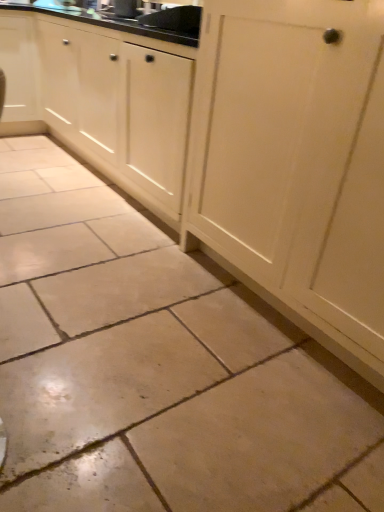
Question: Is matte white cabinet at upper left, arranged as the first cabinetry when viewed from the left, inside the boundaries of matte black sink at upper center, or outside?

Choices:
 (A) outside
 (B) inside

Answer: (A)

Question: Considering the positions of matte white cabinet at upper left, arranged as the first cabinetry when viewed from the left, and matte black sink at upper center in the image, is matte white cabinet at upper left, arranged as the first cabinetry when viewed from the left, bigger or smaller than matte black sink at upper center?

Choices:
 (A) small
 (B) big

Answer: (B)

Question: Which object is positioned closest to the matte white cabinet at upper left, arranged as the 2th cabinetry when viewed from the right?

Choices:
 (A) white wood cabinet at center, which is the first cabinetry in right-to-left order
 (B) matte black sink at upper center

Answer: (A)

Question: Which object is the closest to the white wood cabinet at center, which is the first cabinetry in right-to-left order?

Choices:
 (A) matte black sink at upper center
 (B) matte white cabinet at upper left, arranged as the first cabinetry when viewed from the left

Answer: (B)